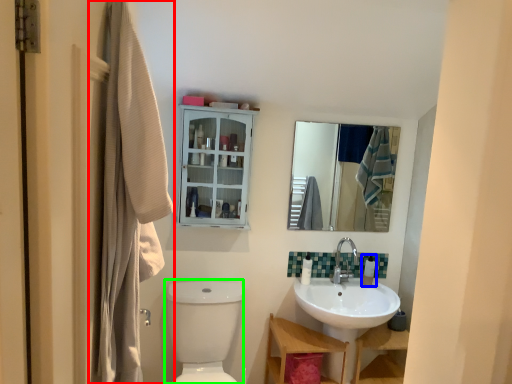
Question: Which object is positioned closest to laundry (highlighted by a red box)? Select from toiletry (highlighted by a blue box) and toilet bowl (highlighted by a green box).

Choices:
 (A) toiletry
 (B) toilet bowl

Answer: (B)